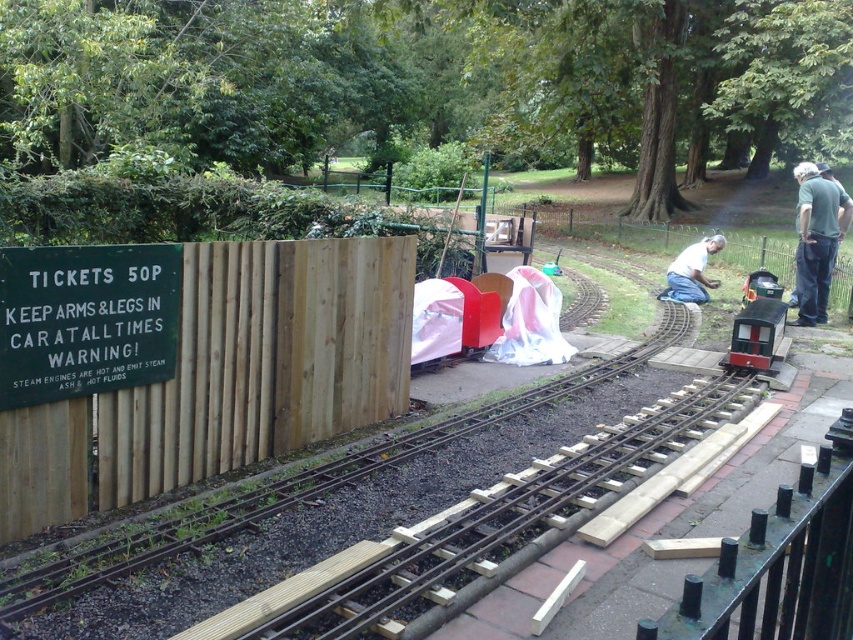
You are a visitor at the miniature railway and want to know if the gray fabric at right can be used to cover the metallic green train at center completely. Based on their sizes, what do you think?

The gray fabric at right has a smaller size compared to the metallic green train at center, so it cannot fully cover the metallic green train at center.